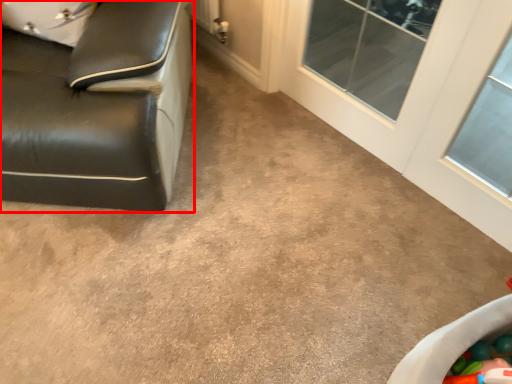
Question: From the image's perspective, considering the relative positions of furniture (annotated by the red box) and glass door in the image provided, where is furniture (annotated by the red box) located with respect to the staircase?

Choices:
 (A) above
 (B) below

Answer: (A)